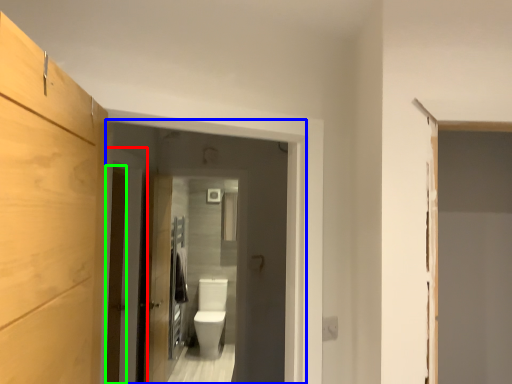
Question: Estimate the real-world distances between objects in this image. Which object is closer to door (highlighted by a red box), screen door (highlighted by a blue box) or barn door (highlighted by a green box)?

Choices:
 (A) screen door
 (B) barn door

Answer: (B)